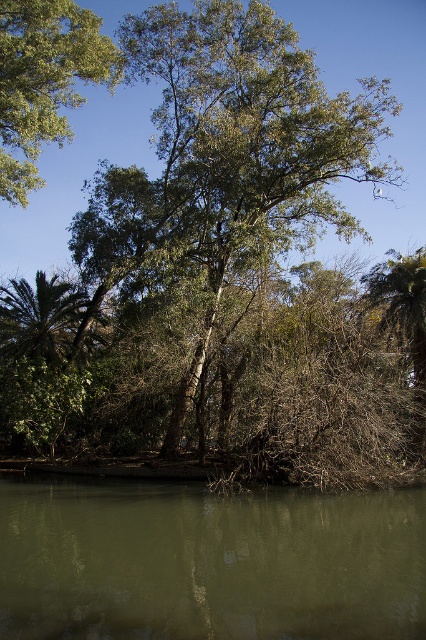
You are planning to plant a new tree in your backyard. You have two options based on the image provided. The first is the green leafy tree at center, and the second is the green leafy palm tree at left. Considering their widths, which tree would require more horizontal space to accommodate its growth?

The green leafy tree at center requires more horizontal space because its width is larger than the green leafy palm tree at left.

You are standing at the edge of the scene and want to cross to the other side. You see the green murky water at lower center and the green leafy palm tree at left. Which one is wider so you can choose the best path?

The green murky water at lower center might be wider than the green leafy palm tree at left, so it could be the better path to cross.